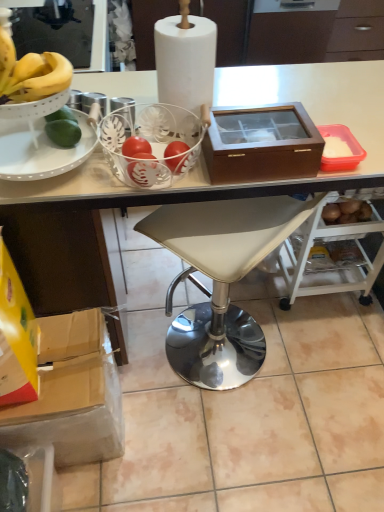
Where is `free region on the left part of white leather stool at center`? free region on the left part of white leather stool at center is located at coordinates (144, 334).